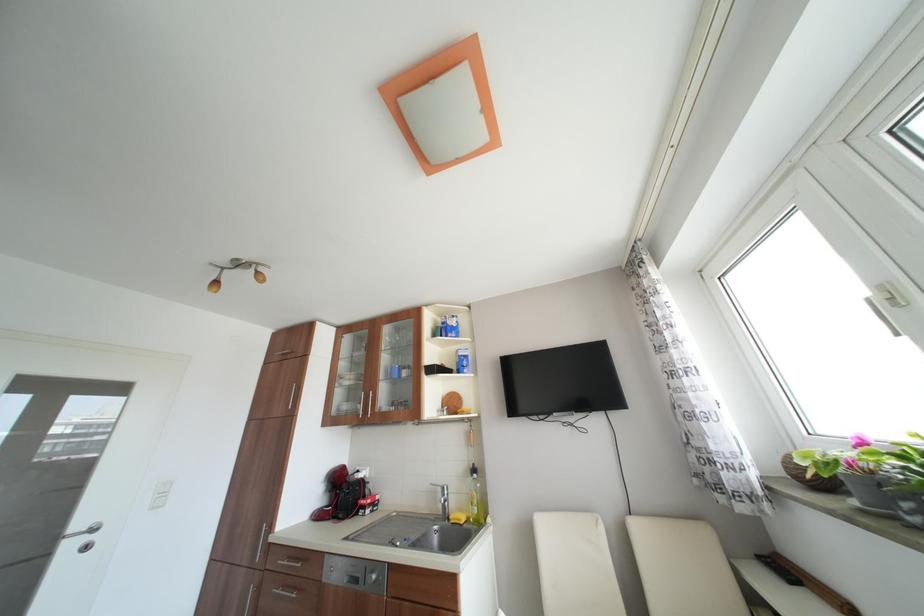
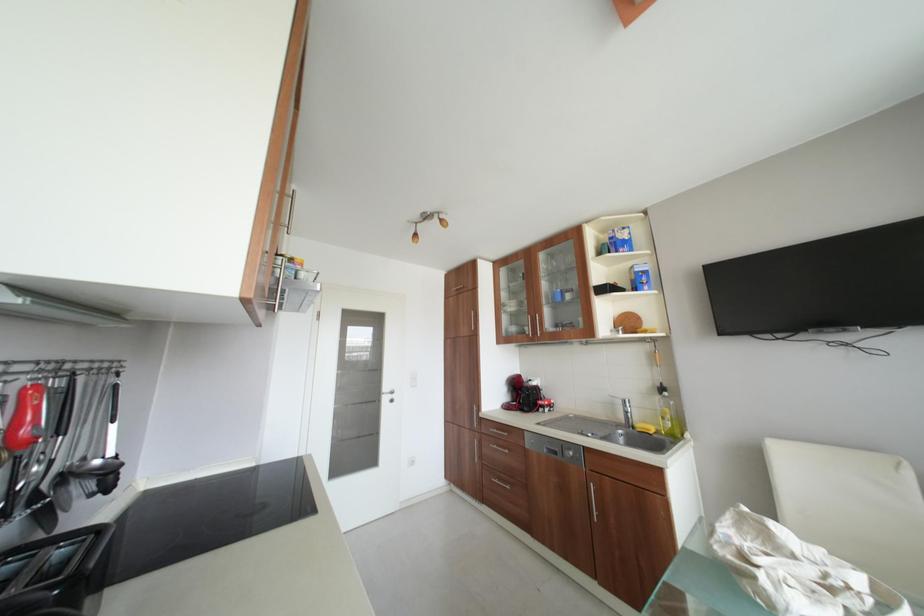
Question: How did the camera likely rotate?

Choices:
 (A) Left
 (B) Right
 (C) Up
 (D) Down

Answer: (A)